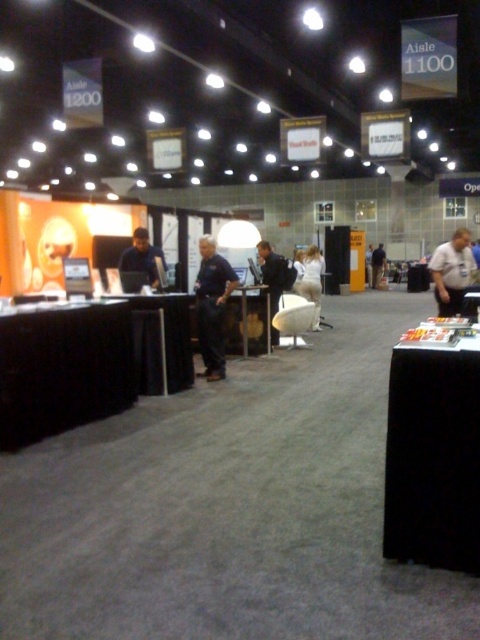
You are navigating through the exhibition hall and need to reach a specific point. You are currently at point (286, 259). Which direction should you move to reach point (68, 381)?

You should move forward to reach point (68, 381) because it is in front of your current position at point (286, 259).

You are navigating an indoor exhibition and need to locate the black fabric table at lower left. According to the provided coordinates, where exactly is it positioned?

The black fabric table at lower left is precisely located at coordinates point (62, 369).